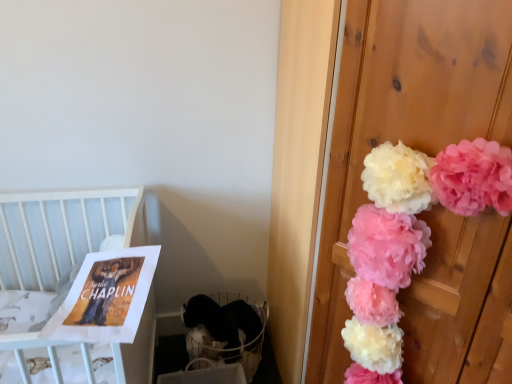
Question: Should I look upward or downward to see white wood crib at upper left?

Choices:
 (A) up
 (B) down

Answer: (B)

Question: From the image's perspective, would you say matte paper poster at left is shown under white wood crib at upper left?

Choices:
 (A) no
 (B) yes

Answer: (A)

Question: Is matte paper poster at left aimed at white wood crib at upper left?

Choices:
 (A) no
 (B) yes

Answer: (B)

Question: Are matte paper poster at left and white wood crib at upper left located far from each other?

Choices:
 (A) yes
 (B) no

Answer: (B)

Question: Considering the relative positions of matte paper poster at left and white wood crib at upper left in the image provided, is matte paper poster at left in front of white wood crib at upper left?

Choices:
 (A) no
 (B) yes

Answer: (A)

Question: Does matte paper poster at left appear on the right side of white wood crib at upper left?

Choices:
 (A) no
 (B) yes

Answer: (B)

Question: Is matte paper poster at left further to the viewer compared to white wood crib at upper left?

Choices:
 (A) no
 (B) yes

Answer: (B)

Question: Does white fabric baby carriage at lower left appear on the right side of pink fluffy pom-poms at right?

Choices:
 (A) yes
 (B) no

Answer: (B)

Question: Is white fabric baby carriage at lower left positioned with its back to pink fluffy pom-poms at right?

Choices:
 (A) yes
 (B) no

Answer: (B)

Question: Does white fabric baby carriage at lower left have a lesser height compared to pink fluffy pom-poms at right?

Choices:
 (A) no
 (B) yes

Answer: (B)

Question: Is white fabric baby carriage at lower left next to pink fluffy pom-poms at right and touching it?

Choices:
 (A) yes
 (B) no

Answer: (B)

Question: Considering the relative positions of white fabric baby carriage at lower left and pink fluffy pom-poms at right in the image provided, is white fabric baby carriage at lower left to the left of pink fluffy pom-poms at right from the viewer's perspective?

Choices:
 (A) no
 (B) yes

Answer: (B)

Question: From the image's perspective, would you say white fabric baby carriage at lower left is shown under pink fluffy pom-poms at right?

Choices:
 (A) yes
 (B) no

Answer: (A)

Question: Is white wood crib at upper left to the right of white fabric baby carriage at lower left from the viewer's perspective?

Choices:
 (A) yes
 (B) no

Answer: (B)